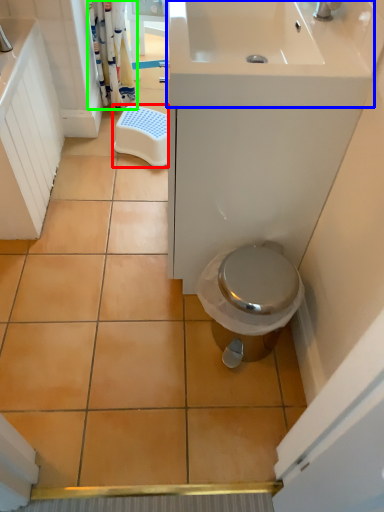
Question: Estimate the real-world distances between objects in this image. Which object is farther from step stool (highlighted by a red box), sink (highlighted by a blue box) or shower curtain (highlighted by a green box)?

Choices:
 (A) sink
 (B) shower curtain

Answer: (A)